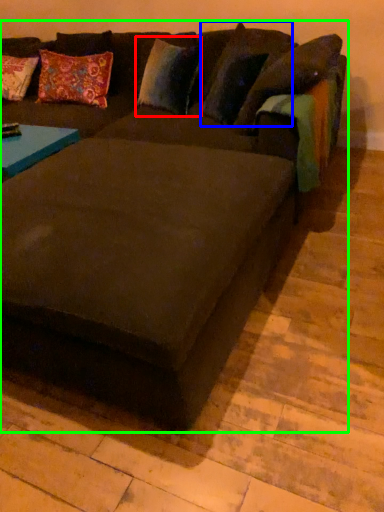
Question: Which object is positioned farthest from pillow (highlighted by a red box)? Select from pillow (highlighted by a blue box) and studio couch (highlighted by a green box).

Choices:
 (A) pillow
 (B) studio couch

Answer: (B)